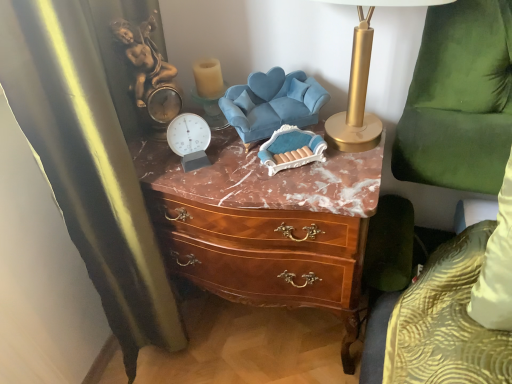
Question: Could you tell me if gold metallic table lamp at upper right is facing green velvet swivel chair at right, which is the 1th swivel chair from right to left?

Choices:
 (A) no
 (B) yes

Answer: (A)

Question: Is gold metallic table lamp at upper right oriented away from green velvet swivel chair at right, which is the 2th swivel chair from left to right?

Choices:
 (A) yes
 (B) no

Answer: (B)

Question: Does gold metallic table lamp at upper right have a lesser width compared to green velvet swivel chair at right, which is the 2th swivel chair from left to right?

Choices:
 (A) yes
 (B) no

Answer: (B)

Question: Can you confirm if gold metallic table lamp at upper right is shorter than green velvet swivel chair at right, which is the 1th swivel chair from right to left?

Choices:
 (A) no
 (B) yes

Answer: (B)

Question: From a real-world perspective, is gold metallic table lamp at upper right on top of green velvet swivel chair at right, which is the 2th swivel chair from left to right?

Choices:
 (A) yes
 (B) no

Answer: (A)

Question: Is velvet blue swivel chair at center, which is the 1th swivel chair from left to right, taller or shorter than metallic silver clock at center?

Choices:
 (A) short
 (B) tall

Answer: (B)

Question: Does point (284, 97) appear closer or farther from the camera than point (199, 134)?

Choices:
 (A) closer
 (B) farther

Answer: (B)

Question: In the image, is velvet blue swivel chair at center, which is the 1th swivel chair from left to right, positioned in front of or behind metallic silver clock at center?

Choices:
 (A) behind
 (B) front

Answer: (A)

Question: Is velvet blue swivel chair at center, which is the 1th swivel chair from left to right, wider or thinner than metallic silver clock at center?

Choices:
 (A) thin
 (B) wide

Answer: (B)

Question: Looking at the image, does translucent glass candle at upper center seem bigger or smaller compared to brown wood chest of drawers at center?

Choices:
 (A) small
 (B) big

Answer: (A)

Question: Is translucent glass candle at upper center wider or thinner than brown wood chest of drawers at center?

Choices:
 (A) thin
 (B) wide

Answer: (A)

Question: Relative to brown wood chest of drawers at center, is translucent glass candle at upper center in front or behind?

Choices:
 (A) front
 (B) behind

Answer: (B)

Question: In terms of height, does translucent glass candle at upper center look taller or shorter compared to brown wood chest of drawers at center?

Choices:
 (A) tall
 (B) short

Answer: (B)

Question: In terms of size, does translucent glass candle at upper center appear bigger or smaller than gold metallic table lamp at upper right?

Choices:
 (A) small
 (B) big

Answer: (A)

Question: Would you say translucent glass candle at upper center is to the left or to the right of gold metallic table lamp at upper right in the picture?

Choices:
 (A) right
 (B) left

Answer: (B)